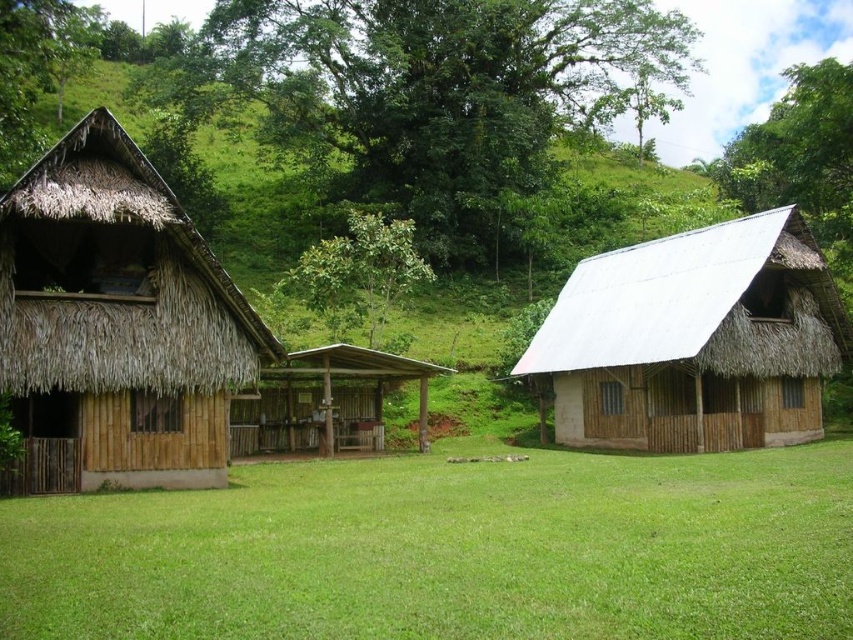
Does thatched bamboo hut at left have a lesser width compared to white thatched hut at right?

Yes, thatched bamboo hut at left is thinner than white thatched hut at right.

Can you confirm if thatched bamboo hut at left is positioned below white thatched hut at right?

No.

Between point (233, 380) and point (732, 259), which one is positioned behind?

The point (732, 259) is more distant.

The image size is (853, 640). I want to click on thatched bamboo hut at left, so click(117, 323).

Which is more to the right, white thatched hut at right or green leafy tree at center?

white thatched hut at right

Is point (666, 374) farther from viewer compared to point (370, 301)?

No, (666, 374) is closer to viewer.

The image size is (853, 640). Find the location of `white thatched hut at right`. white thatched hut at right is located at coordinates (695, 340).

Is point (558, 36) positioned behind point (598, 394)?

Yes, point (558, 36) is behind point (598, 394).

Measure the distance between green leafy tree at upper center and white thatched hut at right.

The distance of green leafy tree at upper center from white thatched hut at right is 68.71 feet.

You are a GUI agent. You are given a task and a screenshot of the screen. Output one action in this format:
    pyautogui.click(x=<x>, y=<y>)
    Task: Click on the green leafy tree at upper center
    This screenshot has width=853, height=640.
    Given the screenshot: What is the action you would take?
    coord(422,92)

This screenshot has height=640, width=853. Find the location of `green leafy tree at upper center`. green leafy tree at upper center is located at coordinates (422, 92).